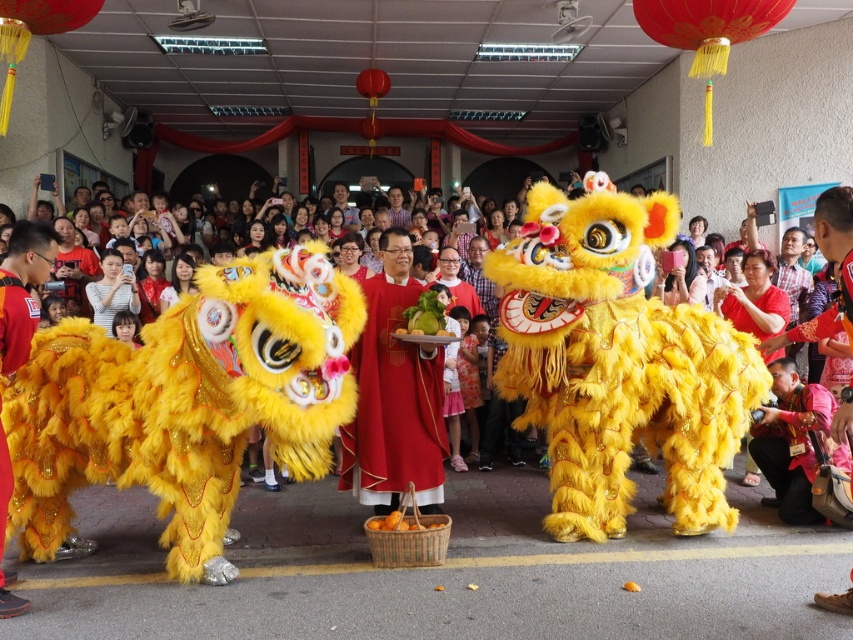
What is located at the coordinates point [393,404] in the scene?

The point [393,404] indicates the location of the silky red robe at center.

You are a photographer at the event and want to capture both the silky red robe at center and the velvet yellow lion costume at center in a single frame. Which object is wider so that you can position it to fill more of the frame?

The silky red robe at center is wider than the velvet yellow lion costume at center, so positioning it to fill more of the frame would be appropriate.

In the scene shown: You are a photographer at the event and want to capture both the silky red robe at center and the velvet yellow lion costume at center in a single shot. Which object should you position closer to the camera to ensure both are fully visible?

The silky red robe at center is shorter than the velvet yellow lion costume at center, so positioning the velvet yellow lion costume at center closer to the camera will allow both to be fully visible in the photo.